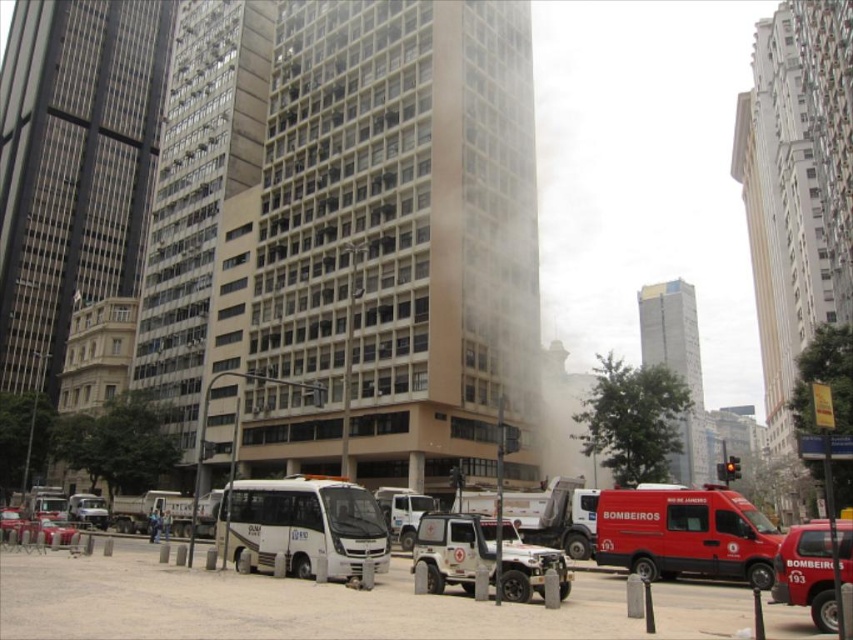
You are a delivery driver needing to park your 5.5 meter long truck between the matte red van at lower right and the white matte emergency vehicle at center. Is there enough space?

The distance between the matte red van at lower right and the white matte emergency vehicle at center is 9.36 meters. Since your truck is 5.5 meters long, there is sufficient space to park it between them as 9.36 meters is greater than 5.5 meters.

You are a pedestrian standing on the sidewalk and see the white matte van at center and the white matte emergency vehicle at center. Which vehicle is closer to you?

The white matte van at center is closer to you because it is positioned under the white matte emergency vehicle at center, indicating it is in a lower, more forward position.

From the picture: You are a pedestrian standing on the sidewalk in the scene. You need to cross the street to reach the white matte emergency vehicle at center. Which direction should you walk to get there from the metallic silver car at lower left?

The white matte emergency vehicle at center is to the right of the metallic silver car at lower left, so you should walk to the right to reach it.